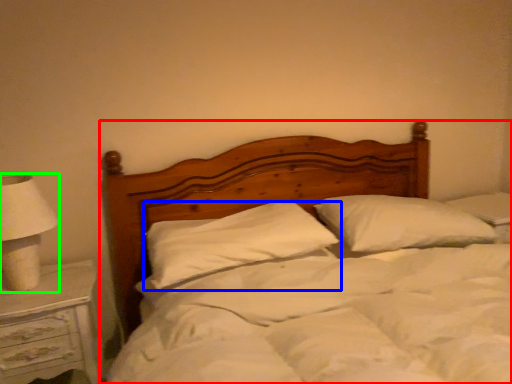
Question: Which object is positioned closest to bed (highlighted by a red box)? Select from pillow (highlighted by a blue box) and lamp (highlighted by a green box).

Choices:
 (A) pillow
 (B) lamp

Answer: (A)